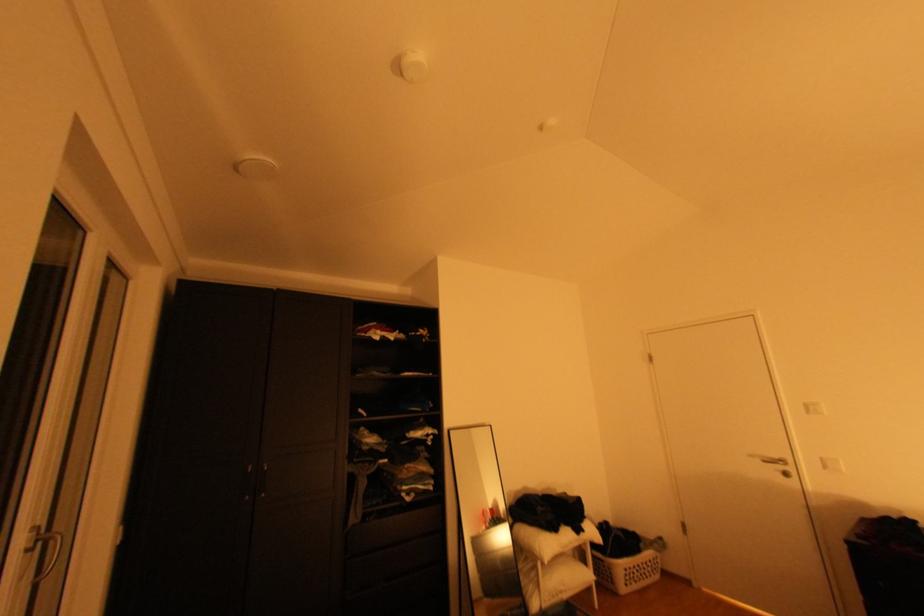
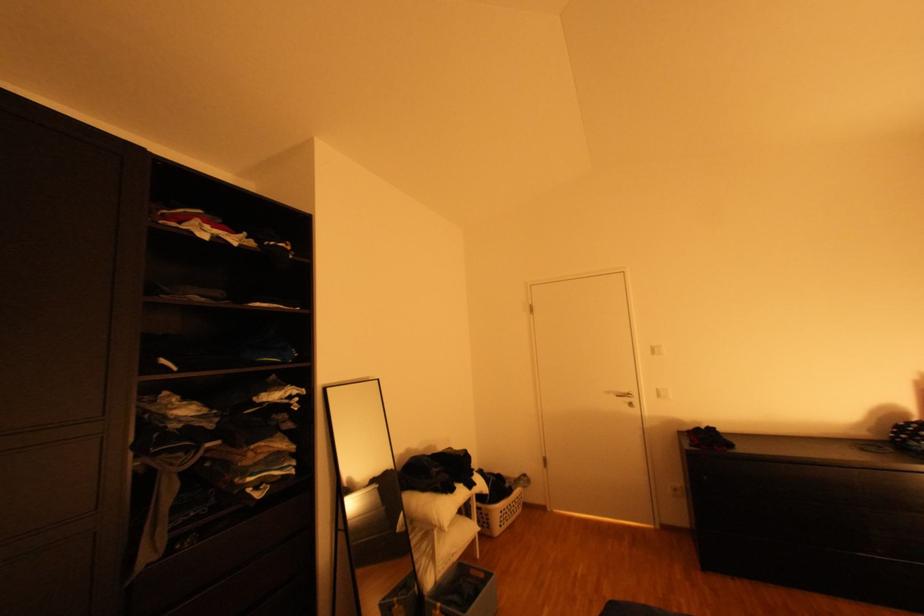
The point at (818,408) is marked in the first image. Where is the corresponding point in the second image?

(662, 349)